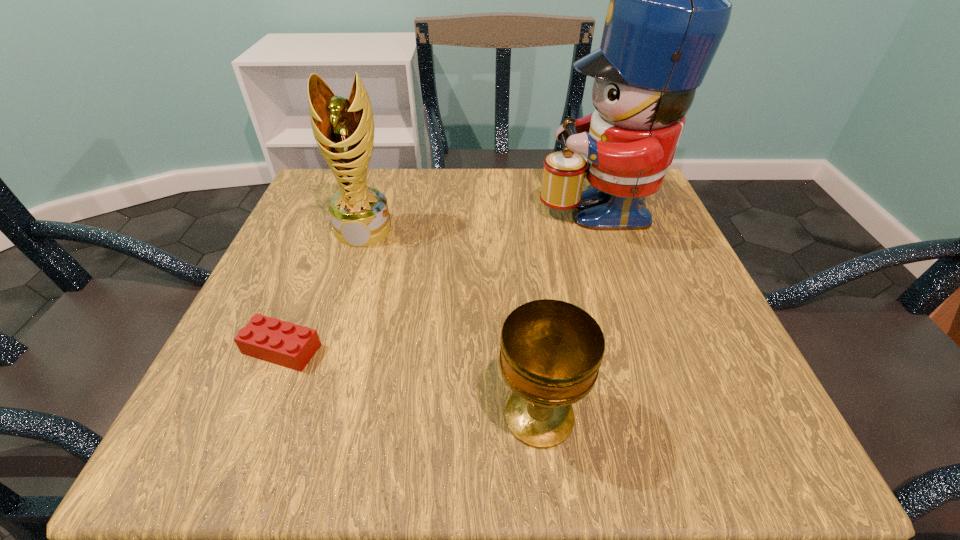
The height and width of the screenshot is (540, 960). I want to click on free spot between the chalice and the third shortest object, so click(x=451, y=323).

Identify the location of free space between the tallest object and the award. (480, 217).

Where is `free point between the Lego and the award`? The height and width of the screenshot is (540, 960). free point between the Lego and the award is located at coordinates (323, 289).

Choose which object is the third nearest neighbor to the award. Please provide its 2D coordinates. Your answer should be formatted as a tuple, i.e. [(x, y)], where the tuple contains the x and y coordinates of a point satisfying the conditions above.

[(551, 351)]

This screenshot has height=540, width=960. Identify the location of object that is the closest to the chalice. (283, 343).

Locate an element on the screen. vacant region that satisfies the following two spatial constraints: 1. on the front-facing side of the nutcracker; 2. on the front side of the shortest object is located at coordinates (646, 349).

The image size is (960, 540). In order to click on free space that satisfies the following two spatial constraints: 1. on the front-facing side of the nutcracker; 2. on the front-facing side of the award in this screenshot , I will do `click(606, 230)`.

Identify the location of free space that satisfies the following two spatial constraints: 1. on the front-facing side of the second shortest object; 2. on the left side of the award. The image size is (960, 540). (303, 416).